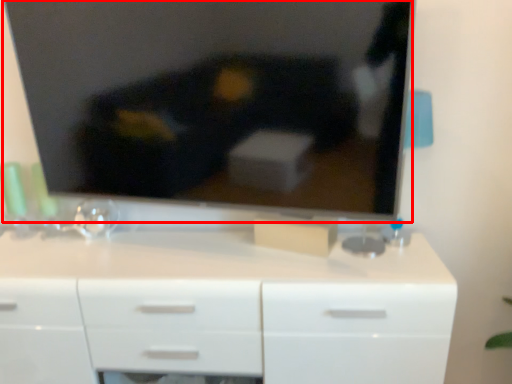
Question: From the image's perspective, what is the correct spatial positioning of television (annotated by the red box) in reference to chest of drawers?

Choices:
 (A) above
 (B) below

Answer: (A)